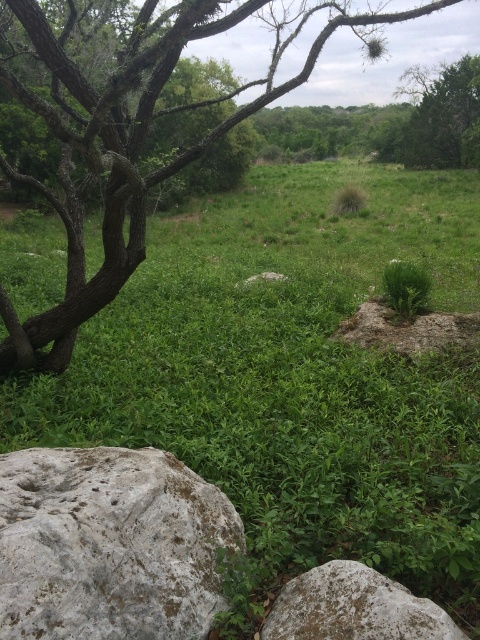
From the picture: You are a hiker trying to cross a narrow path between the gray rough rock at lower left and the green leafy tree at left. Can you pass through the space between them?

The gray rough rock at lower left is thinner than the green leafy tree at left, so the space between them is wide enough for a hiker to pass through.

You are a hiker trying to navigate through the landscape shown. You need to decide whether to take a path that goes around the green leafy tree at left or the gray rough rock at lower right. Which path would require more space due to the size of the object?

The green leafy tree at left is bigger than the gray rough rock at lower right, so the path around the green leafy tree at left would require more space.